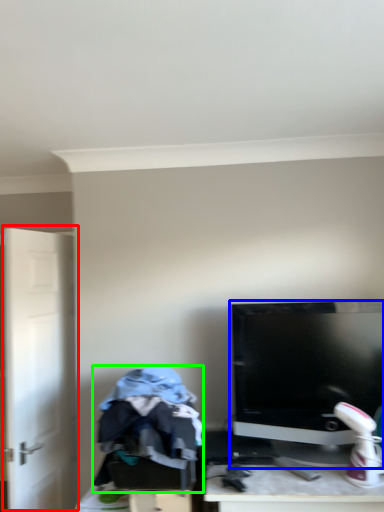
Question: Estimate the real-world distances between objects in this image. Which object is closer to door (highlighted by a red box), computer monitor (highlighted by a blue box) or clothing (highlighted by a green box)?

Choices:
 (A) computer monitor
 (B) clothing

Answer: (B)